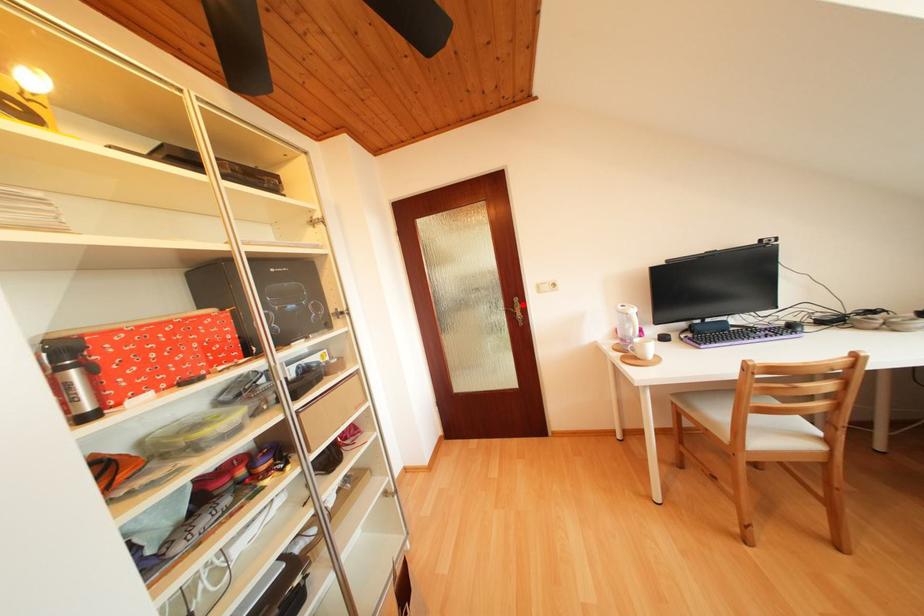
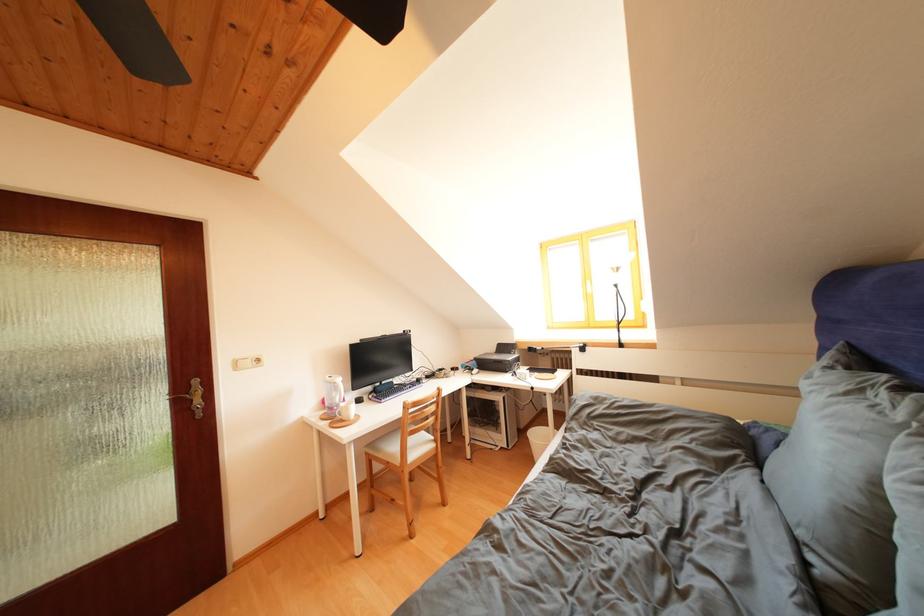
Find the pixel in the second image that matches the highlighted location in the first image.

(201, 387)